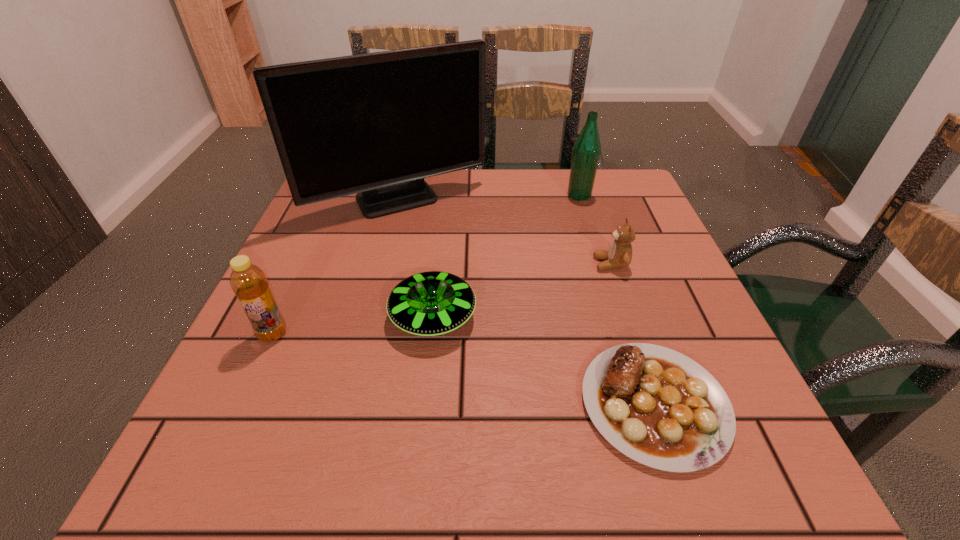
Locate an element on the screen. The image size is (960, 540). vacant region between the second tallest object and the shortest object is located at coordinates (617, 299).

Locate an element on the screen. unoccupied area between the shortest object and the farther bottle is located at coordinates (617, 299).

You are a GUI agent. You are given a task and a screenshot of the screen. Output one action in this format:
    pyautogui.click(x=<x>, y=<y>)
    Task: Click on the free space between the saucer and the third farthest object
    The image size is (960, 540).
    Given the screenshot: What is the action you would take?
    pyautogui.click(x=522, y=291)

Where is `object that is the third closest to the farther bottle`? This screenshot has width=960, height=540. object that is the third closest to the farther bottle is located at coordinates (433, 303).

Find the location of `object that is the fourth closest to the steak`. object that is the fourth closest to the steak is located at coordinates (586, 152).

Locate an element on the screen. free space that satisfies the following two spatial constraints: 1. on the back side of the shorter bottle; 2. on the left side of the saucer is located at coordinates (280, 317).